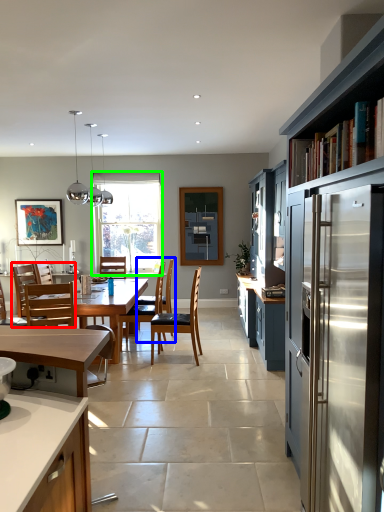
Question: Which object is positioned farthest from chair (highlighted by a red box)? Select from armchair (highlighted by a blue box) and window (highlighted by a green box).

Choices:
 (A) armchair
 (B) window

Answer: (B)